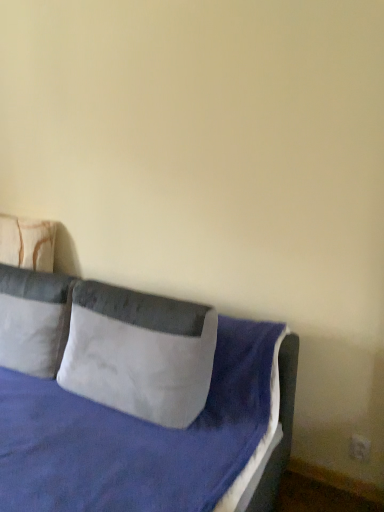
Image resolution: width=384 pixels, height=512 pixels. Identify the location of gray suede pillow at center, acting as the 3th pillow starting from the left. (139, 353).

What do you see at coordinates (139, 353) in the screenshot? This screenshot has width=384, height=512. I see `gray suede pillow at center, acting as the 3th pillow starting from the left` at bounding box center [139, 353].

You are a GUI agent. You are given a task and a screenshot of the screen. Output one action in this format:
    pyautogui.click(x=<x>, y=<y>)
    Task: Click on the beige fabric pillow at left, marked as the first pillow in a left-to-right arrangement
    
    Given the screenshot: What is the action you would take?
    pyautogui.click(x=27, y=243)

I want to click on white soft pillow at left, arranged as the 2th pillow when viewed from the right, so click(x=34, y=320).

From the image's perspective, is velvet blue bed at center above or below beige fabric pillow at left, marked as the first pillow in a left-to-right arrangement?

Based on their image positions, velvet blue bed at center is located beneath beige fabric pillow at left, marked as the first pillow in a left-to-right arrangement.

Is velvet blue bed at center looking in the opposite direction of beige fabric pillow at left, marked as the first pillow in a left-to-right arrangement?

No.

Where is `the 3rd pillow above the velvet blue bed at center (from a real-world perspective)`? This screenshot has height=512, width=384. the 3rd pillow above the velvet blue bed at center (from a real-world perspective) is located at coordinates (27, 243).

Is gray suede pillow at center, which ranks as the first pillow in right-to-left order, situated inside beige fabric pillow at left, which appears as the third pillow when viewed from the right, or outside?

gray suede pillow at center, which ranks as the first pillow in right-to-left order, exists outside the volume of beige fabric pillow at left, which appears as the third pillow when viewed from the right.

How far apart are gray suede pillow at center, acting as the 3th pillow starting from the left, and beige fabric pillow at left, marked as the first pillow in a left-to-right arrangement?

The distance of gray suede pillow at center, acting as the 3th pillow starting from the left, from beige fabric pillow at left, marked as the first pillow in a left-to-right arrangement, is 31.05 inches.

Does gray suede pillow at center, acting as the 3th pillow starting from the left, turn towards beige fabric pillow at left, marked as the first pillow in a left-to-right arrangement?

No.

Is white soft pillow at left, positioned as the second pillow in left-to-right order, not within beige fabric pillow at left, which appears as the third pillow when viewed from the right?

Indeed, white soft pillow at left, positioned as the second pillow in left-to-right order, is completely outside beige fabric pillow at left, which appears as the third pillow when viewed from the right.

Where is `pillow on the left of white soft pillow at left, positioned as the second pillow in left-to-right order`? pillow on the left of white soft pillow at left, positioned as the second pillow in left-to-right order is located at coordinates (27, 243).

Is point (9, 291) positioned after point (8, 257)?

No, it is in front of (8, 257).

Looking at the image, does white soft pillow at left, positioned as the second pillow in left-to-right order, seem bigger or smaller compared to beige fabric pillow at left, which appears as the third pillow when viewed from the right?

white soft pillow at left, positioned as the second pillow in left-to-right order, is bigger than beige fabric pillow at left, which appears as the third pillow when viewed from the right.

Can you tell me how much velvet blue bed at center and white soft pillow at left, positioned as the second pillow in left-to-right order, differ in facing direction?

2.17 degrees separate the facing orientations of velvet blue bed at center and white soft pillow at left, positioned as the second pillow in left-to-right order.

From the image's perspective, between velvet blue bed at center and white soft pillow at left, positioned as the second pillow in left-to-right order, which one is located above?

white soft pillow at left, positioned as the second pillow in left-to-right order, is shown above in the image.

The width and height of the screenshot is (384, 512). Find the location of `the 2nd pillow above when counting from the velvet blue bed at center (from the image's perspective)`. the 2nd pillow above when counting from the velvet blue bed at center (from the image's perspective) is located at coordinates (34, 320).

Is velvet blue bed at center closer to the viewer compared to white soft pillow at left, positioned as the second pillow in left-to-right order?

Yes, it is.

Can you confirm if beige fabric pillow at left, marked as the first pillow in a left-to-right arrangement, is taller than white soft pillow at left, arranged as the 2th pillow when viewed from the right?

Incorrect, the height of beige fabric pillow at left, marked as the first pillow in a left-to-right arrangement, is not larger of that of white soft pillow at left, arranged as the 2th pillow when viewed from the right.

Considering the relative sizes of beige fabric pillow at left, which appears as the third pillow when viewed from the right, and white soft pillow at left, arranged as the 2th pillow when viewed from the right, in the image provided, is beige fabric pillow at left, which appears as the third pillow when viewed from the right, bigger than white soft pillow at left, arranged as the 2th pillow when viewed from the right,?

No, beige fabric pillow at left, which appears as the third pillow when viewed from the right, is not bigger than white soft pillow at left, arranged as the 2th pillow when viewed from the right.

Is point (41, 255) positioned after point (37, 272)?

Yes, point (41, 255) is farther from viewer.

How far apart are velvet blue bed at center and gray suede pillow at center, acting as the 3th pillow starting from the left?

velvet blue bed at center is 8.54 centimeters away from gray suede pillow at center, acting as the 3th pillow starting from the left.

At what (x,y) coordinates should I click in order to perform the action: click on bed in front of the gray suede pillow at center, acting as the 3th pillow starting from the left. Please return your answer as a coordinate pair (x, y). The height and width of the screenshot is (512, 384). Looking at the image, I should click on (122, 412).

Between velvet blue bed at center and gray suede pillow at center, which ranks as the first pillow in right-to-left order, which one has larger width?

Wider between the two is velvet blue bed at center.

From the image's perspective, is velvet blue bed at center above or below gray suede pillow at center, which ranks as the first pillow in right-to-left order?

From the image's perspective, velvet blue bed at center appears below gray suede pillow at center, which ranks as the first pillow in right-to-left order.

Which object is wider, white soft pillow at left, positioned as the second pillow in left-to-right order, or gray suede pillow at center, which ranks as the first pillow in right-to-left order?

white soft pillow at left, positioned as the second pillow in left-to-right order, is wider.

Does point (54, 304) lie behind point (155, 367)?

That is True.

From the image's perspective, relative to gray suede pillow at center, acting as the 3th pillow starting from the left, is white soft pillow at left, arranged as the 2th pillow when viewed from the right, above or below?

From the image's perspective, white soft pillow at left, arranged as the 2th pillow when viewed from the right, appears above gray suede pillow at center, acting as the 3th pillow starting from the left.

Based on the photo, does white soft pillow at left, arranged as the 2th pillow when viewed from the right, come in front of gray suede pillow at center, acting as the 3th pillow starting from the left?

No, white soft pillow at left, arranged as the 2th pillow when viewed from the right, is further to the viewer.

From the image's perspective, which pillow is the 3rd one above the velvet blue bed at center? Please provide its 2D coordinates.

[(27, 243)]

From the image's perspective, starting from the beige fabric pillow at left, which appears as the third pillow when viewed from the right, which pillow is the 2nd one below? Please provide its 2D coordinates.

[(139, 353)]

Based on their spatial positions, is white soft pillow at left, arranged as the 2th pillow when viewed from the right, or beige fabric pillow at left, which appears as the third pillow when viewed from the right, closer to velvet blue bed at center?

white soft pillow at left, arranged as the 2th pillow when viewed from the right.

When comparing their distances from gray suede pillow at center, which ranks as the first pillow in right-to-left order, does velvet blue bed at center or beige fabric pillow at left, which appears as the third pillow when viewed from the right, seem further?

Based on the image, beige fabric pillow at left, which appears as the third pillow when viewed from the right, appears to be further to gray suede pillow at center, which ranks as the first pillow in right-to-left order.

Considering their positions, is white soft pillow at left, positioned as the second pillow in left-to-right order, positioned further to velvet blue bed at center than gray suede pillow at center, which ranks as the first pillow in right-to-left order?

white soft pillow at left, positioned as the second pillow in left-to-right order, is further to velvet blue bed at center.

Looking at this image, from the image, which object appears to be farther from gray suede pillow at center, acting as the 3th pillow starting from the left, beige fabric pillow at left, which appears as the third pillow when viewed from the right, or velvet blue bed at center?

The object further to gray suede pillow at center, acting as the 3th pillow starting from the left, is beige fabric pillow at left, which appears as the third pillow when viewed from the right.

Based on their spatial positions, is white soft pillow at left, arranged as the 2th pillow when viewed from the right, or beige fabric pillow at left, marked as the first pillow in a left-to-right arrangement, closer to gray suede pillow at center, which ranks as the first pillow in right-to-left order?

white soft pillow at left, arranged as the 2th pillow when viewed from the right, is closer to gray suede pillow at center, which ranks as the first pillow in right-to-left order.

From the image, which object appears to be nearer to beige fabric pillow at left, marked as the first pillow in a left-to-right arrangement, gray suede pillow at center, which ranks as the first pillow in right-to-left order, or velvet blue bed at center?

velvet blue bed at center lies closer to beige fabric pillow at left, marked as the first pillow in a left-to-right arrangement, than the other object.

Which object lies further to the anchor point beige fabric pillow at left, which appears as the third pillow when viewed from the right, velvet blue bed at center or white soft pillow at left, arranged as the 2th pillow when viewed from the right?

velvet blue bed at center is positioned further to the anchor beige fabric pillow at left, which appears as the third pillow when viewed from the right.

Based on their spatial positions, is beige fabric pillow at left, which appears as the third pillow when viewed from the right, or white soft pillow at left, positioned as the second pillow in left-to-right order, closer to velvet blue bed at center?

white soft pillow at left, positioned as the second pillow in left-to-right order, is positioned closer to the anchor velvet blue bed at center.

The width and height of the screenshot is (384, 512). What are the coordinates of `pillow between gray suede pillow at center, which ranks as the first pillow in right-to-left order, and beige fabric pillow at left, marked as the first pillow in a left-to-right arrangement, from front to back` in the screenshot? It's located at (34, 320).

Locate an element on the screen. pillow between velvet blue bed at center and white soft pillow at left, positioned as the second pillow in left-to-right order, along the z-axis is located at coordinates (139, 353).